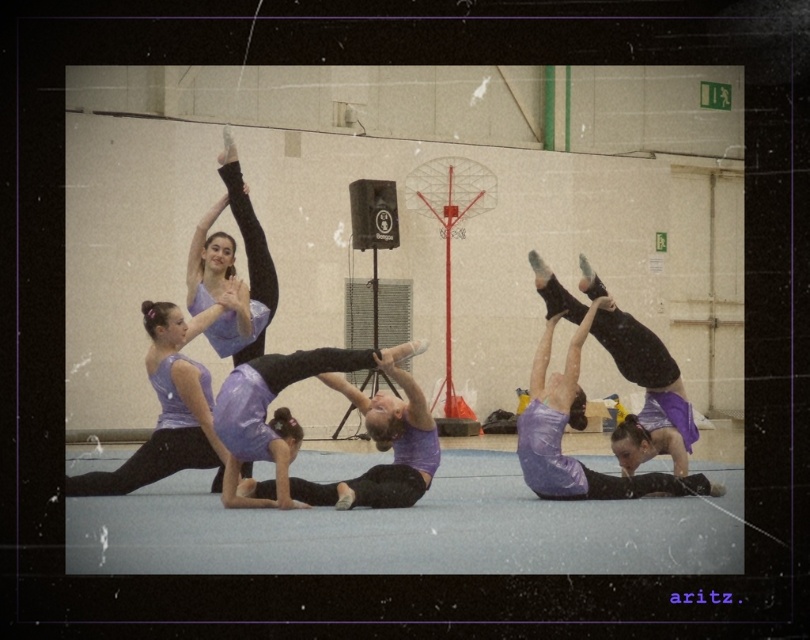
Question: Does matte purple leotard at right come behind matte purple leotard at upper left?

Choices:
 (A) yes
 (B) no

Answer: (A)

Question: Is purple matte gymnast at center wider than matte purple leotard at upper left?

Choices:
 (A) yes
 (B) no

Answer: (A)

Question: Which point appears farthest from the camera in this image?

Choices:
 (A) (99, 488)
 (B) (648, 404)

Answer: (B)

Question: Is purple matte leggings at center bigger than purple matte gymnast at center?

Choices:
 (A) yes
 (B) no

Answer: (A)

Question: Which object is closer to the camera taking this photo?

Choices:
 (A) purple matte leggings at center
 (B) matte purple leotard at upper left
 (C) purple matte gymnast at center

Answer: (C)

Question: Among these points, which one is farthest from the camera?

Choices:
 (A) (229, 244)
 (B) (195, 448)
 (C) (363, 403)
 (D) (565, 289)

Answer: (D)